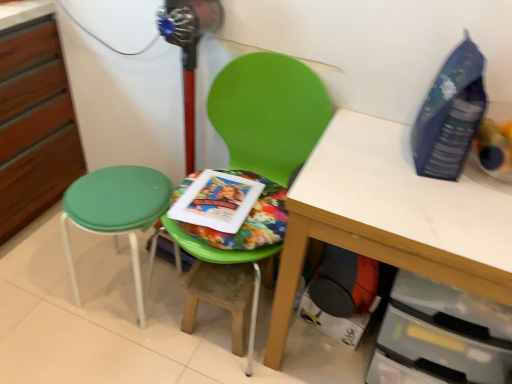
What are the coordinates of `vacant region to the left of wooden step stool at center` in the screenshot? It's located at (156, 327).